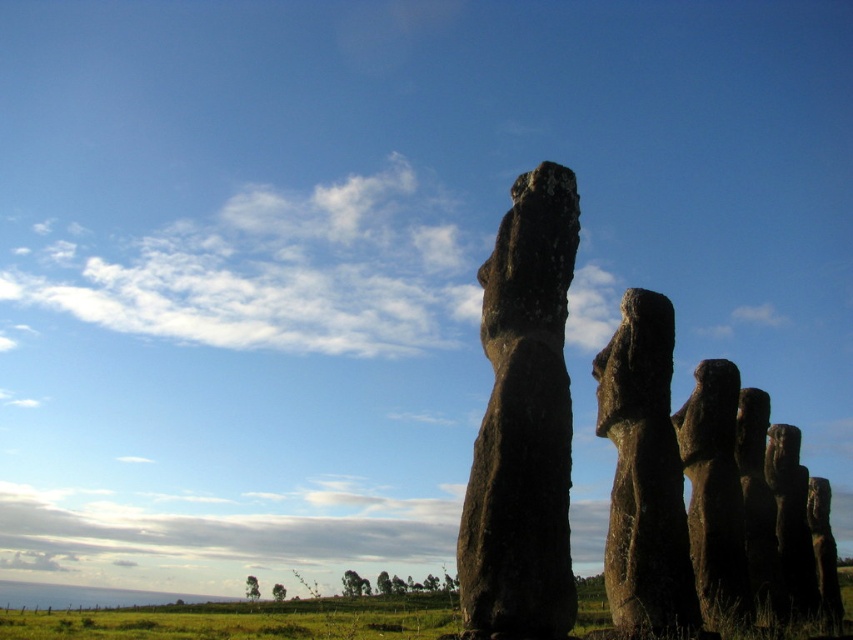
You are a tour guide leading a group of visitors on a path that is 20 meters long. You want to walk from the rough stone statue at center to the dark brown stone statue at right. Can you walk directly between them without needing to go around any obstacles?

The rough stone statue at center and dark brown stone statue at right are 18.12 meters apart, so yes, the path between them is shorter than the 20 meter path, so you can walk directly between them without needing to go around any obstacles.

You are a tour guide explaining the layout of the statues to visitors. Pointing to the rough stone statue at center and the dark brown stone statue at right, you want to describe their positions relative to each other. Which statue is positioned to the left of the other?

The rough stone statue at center is positioned to the left of the dark brown stone statue at right.

You are standing at the point with coordinates 0.5, 0.5 in the image. You want to walk to the rough stone statue at center. In which direction should you move?

You should move northeast to reach the rough stone statue at center located at point (523, 422) from your current position at (426, 320).